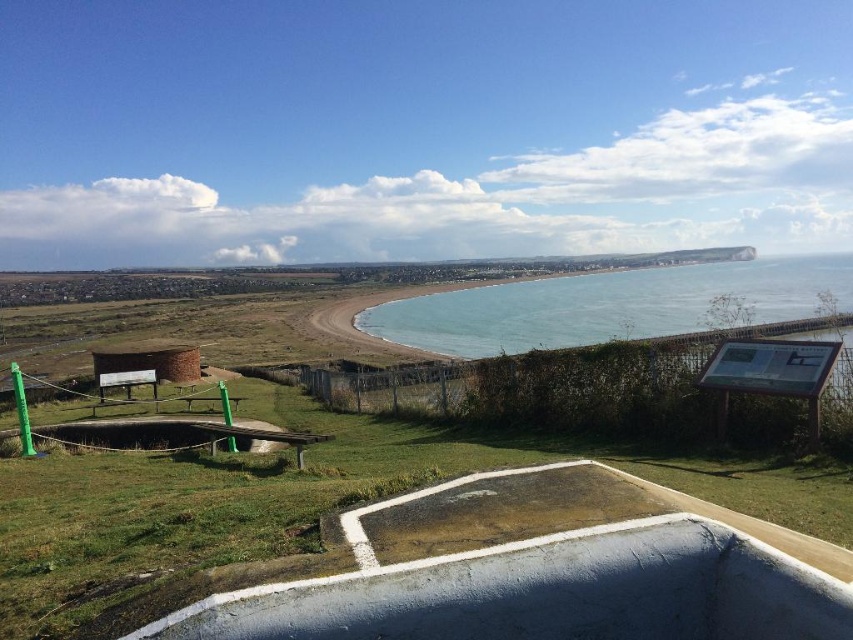
Question: Considering the relative positions of blue water at center and brick-red brick hut at lower left in the image provided, where is blue water at center located with respect to brick-red brick hut at lower left?

Choices:
 (A) above
 (B) below

Answer: (A)

Question: Which point is closer to the camera?

Choices:
 (A) blue water at center
 (B) brick-red brick hut at lower left
 (C) green grassy at lower left

Answer: (C)

Question: Does green grassy at lower left appear over blue water at center?

Choices:
 (A) yes
 (B) no

Answer: (B)

Question: Which object is positioned farthest from the brick-red brick hut at lower left?

Choices:
 (A) green grassy at lower left
 (B) blue water at center

Answer: (B)

Question: Does green grassy at lower left have a greater width compared to brick-red brick hut at lower left?

Choices:
 (A) yes
 (B) no

Answer: (A)

Question: Which point is closer to the camera taking this photo?

Choices:
 (A) (96, 552)
 (B) (708, 301)

Answer: (A)